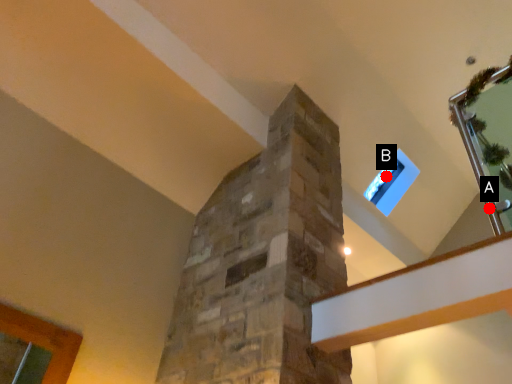
Question: Two points are circled on the image, labeled by A and B beside each circle. Which of the following is the closest to the observer?

Choices:
 (A) A is closer
 (B) B is closer

Answer: (A)